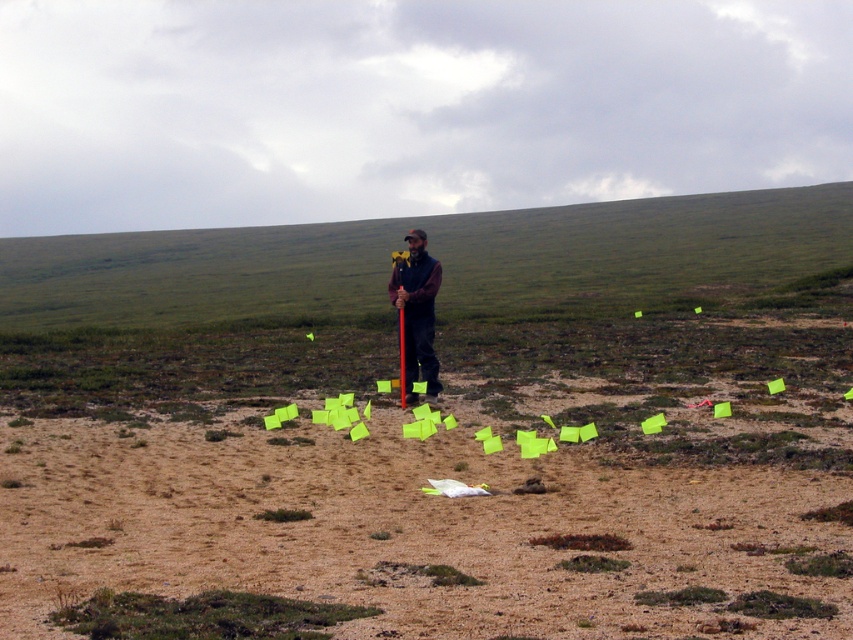
Question: Among these objects, which one is nearest to the camera?

Choices:
 (A) metallic pole at center
 (B) dark blue fabric jacket at center

Answer: (A)

Question: Is brown sandy dirt at lower center positioned in front of dark blue fabric jacket at center?

Choices:
 (A) yes
 (B) no

Answer: (A)

Question: Does brown sandy dirt at lower center have a smaller size compared to metallic pole at center?

Choices:
 (A) yes
 (B) no

Answer: (A)

Question: Which of the following is the closest to the observer?

Choices:
 (A) dark blue fabric jacket at center
 (B) metallic pole at center

Answer: (B)

Question: Considering the real-world distances, which object is farthest from the dark blue fabric jacket at center?

Choices:
 (A) metallic pole at center
 (B) brown sandy dirt at lower center

Answer: (B)

Question: Is brown sandy dirt at lower center closer to the viewer compared to metallic pole at center?

Choices:
 (A) yes
 (B) no

Answer: (A)